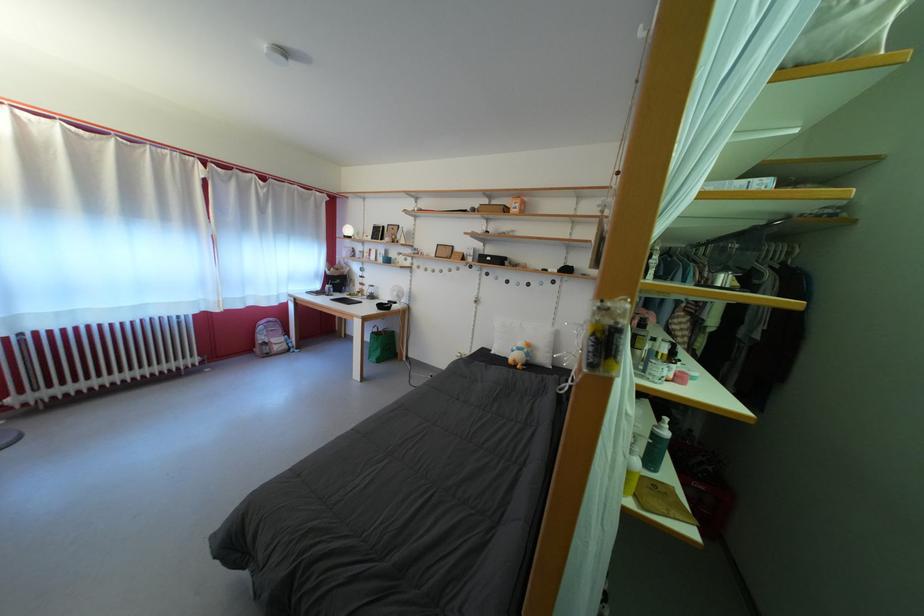
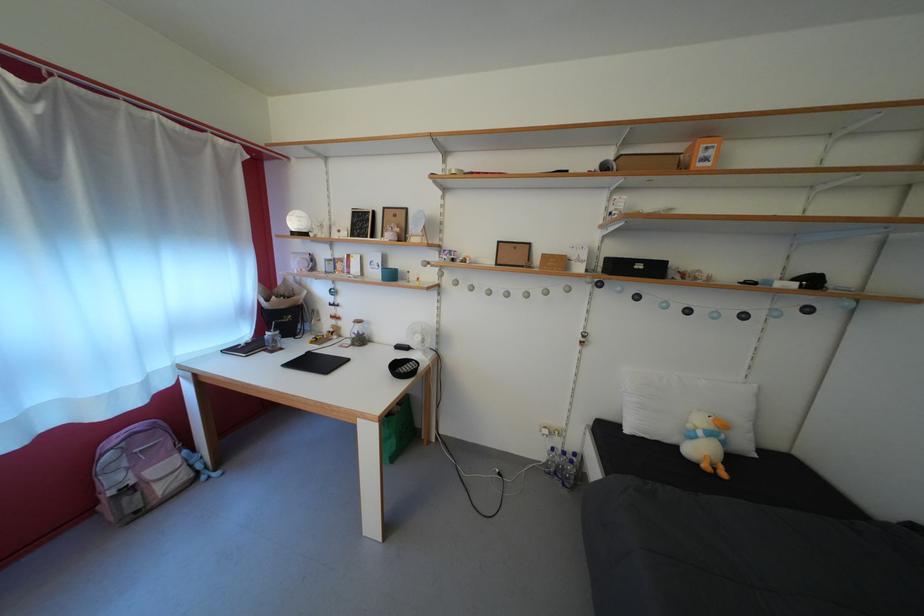
In the second image, find the point that corresponds to the point at 388,265 in the first image.

(383, 280)